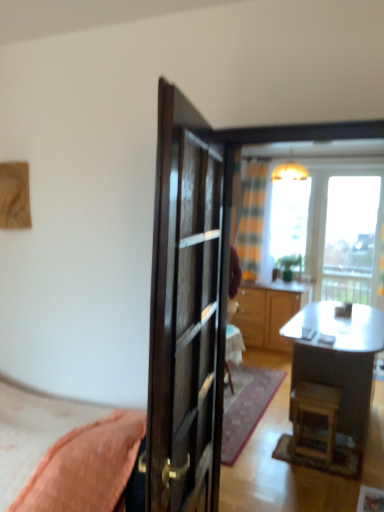
At what (x,y) coordinates should I click in order to perform the action: click on free spot above transparent glass window at upper right (from a real-world perspective). Please return your answer as a coordinate pair (x, y). Looking at the image, I should click on (358, 164).